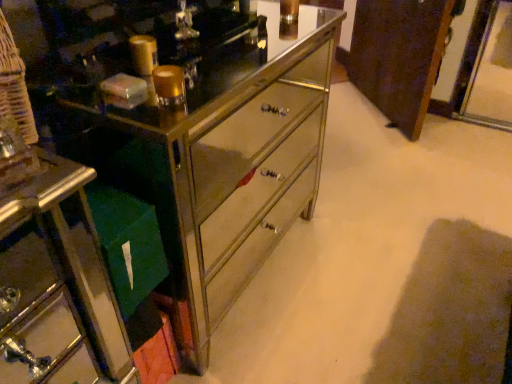
Question: Considering the relative sizes of metallic mirrored chest of drawers at center and green fabric bag at lower left in the image provided, is metallic mirrored chest of drawers at center thinner than green fabric bag at lower left?

Choices:
 (A) no
 (B) yes

Answer: (A)

Question: Is metallic mirrored chest of drawers at center next to green fabric bag at lower left?

Choices:
 (A) yes
 (B) no

Answer: (B)

Question: Does metallic mirrored chest of drawers at center appear on the right side of green fabric bag at lower left?

Choices:
 (A) yes
 (B) no

Answer: (A)

Question: Is metallic mirrored chest of drawers at center not close to green fabric bag at lower left?

Choices:
 (A) yes
 (B) no

Answer: (B)

Question: Can you confirm if metallic mirrored chest of drawers at center is bigger than green fabric bag at lower left?

Choices:
 (A) no
 (B) yes

Answer: (B)

Question: Is brown wood cabinet at center to the left or to the right of green fabric bag at lower left in the image?

Choices:
 (A) left
 (B) right

Answer: (B)

Question: From a real-world perspective, is brown wood cabinet at center positioned above or below green fabric bag at lower left?

Choices:
 (A) above
 (B) below

Answer: (A)

Question: Is brown wood cabinet at center situated inside green fabric bag at lower left or outside?

Choices:
 (A) inside
 (B) outside

Answer: (B)

Question: From the image's perspective, is brown wood cabinet at center positioned above or below green fabric bag at lower left?

Choices:
 (A) below
 (B) above

Answer: (B)

Question: From a real-world perspective, is brown wood cabinet at center positioned above or below metallic mirrored chest of drawers at center?

Choices:
 (A) above
 (B) below

Answer: (B)

Question: In terms of width, does brown wood cabinet at center look wider or thinner when compared to metallic mirrored chest of drawers at center?

Choices:
 (A) thin
 (B) wide

Answer: (A)

Question: In terms of height, does brown wood cabinet at center look taller or shorter compared to metallic mirrored chest of drawers at center?

Choices:
 (A) short
 (B) tall

Answer: (A)

Question: Considering the relative positions of brown wood cabinet at center and metallic mirrored chest of drawers at center in the image provided, is brown wood cabinet at center to the left or to the right of metallic mirrored chest of drawers at center?

Choices:
 (A) left
 (B) right

Answer: (B)

Question: From a real-world perspective, is metallic mirrored chest of drawers at center above or below brown wood cabinet at center?

Choices:
 (A) above
 (B) below

Answer: (A)

Question: Visually, is metallic mirrored chest of drawers at center positioned to the left or to the right of brown wood cabinet at center?

Choices:
 (A) right
 (B) left

Answer: (B)